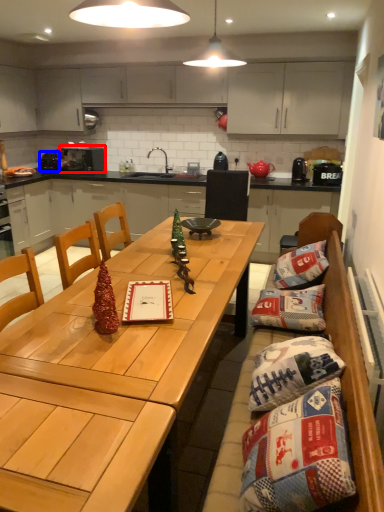
Question: Which object appears closest to the camera in this image, appliance (highlighted by a red box) or appliance (highlighted by a blue box)?

Choices:
 (A) appliance
 (B) appliance

Answer: (A)